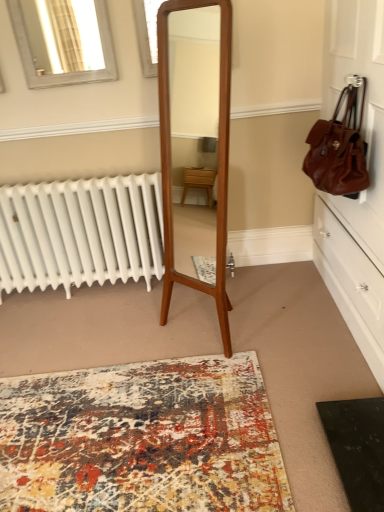
Question: Is matte glass window at upper center, the first window from the right, directly adjacent to matte brown leather dresser at right?

Choices:
 (A) no
 (B) yes

Answer: (A)

Question: From the image's perspective, is matte glass window at upper center, the first window from the right, located beneath matte brown leather dresser at right?

Choices:
 (A) no
 (B) yes

Answer: (A)

Question: From a real-world perspective, does matte glass window at upper center, the first window from the right, stand above matte brown leather dresser at right?

Choices:
 (A) no
 (B) yes

Answer: (B)

Question: Does matte glass window at upper center, which is counted as the second window, starting from the left, have a greater height compared to matte brown leather dresser at right?

Choices:
 (A) yes
 (B) no

Answer: (B)

Question: Could you tell me if matte glass window at upper center, the first window from the right, is facing matte brown leather dresser at right?

Choices:
 (A) yes
 (B) no

Answer: (B)

Question: Is matte brown leather dresser at right completely or partially inside matte glass window at upper center, the first window from the right?

Choices:
 (A) no
 (B) yes

Answer: (A)

Question: Is brown leather handbag at upper right positioned behind matte brown leather dresser at right?

Choices:
 (A) yes
 (B) no

Answer: (A)

Question: Can you confirm if brown leather handbag at upper right is wider than matte brown leather dresser at right?

Choices:
 (A) no
 (B) yes

Answer: (A)

Question: Would you say brown leather handbag at upper right contains matte brown leather dresser at right?

Choices:
 (A) no
 (B) yes

Answer: (A)

Question: Does brown leather handbag at upper right have a greater height compared to matte brown leather dresser at right?

Choices:
 (A) yes
 (B) no

Answer: (B)

Question: Does brown leather handbag at upper right have a smaller size compared to matte brown leather dresser at right?

Choices:
 (A) no
 (B) yes

Answer: (B)

Question: Considering the relative positions of brown leather handbag at upper right and matte brown leather dresser at right in the image provided, is brown leather handbag at upper right to the left of matte brown leather dresser at right from the viewer's perspective?

Choices:
 (A) no
 (B) yes

Answer: (B)

Question: Is brown leather handbag at upper right far away from matte glass window at upper center, which is counted as the second window, starting from the left?

Choices:
 (A) no
 (B) yes

Answer: (B)